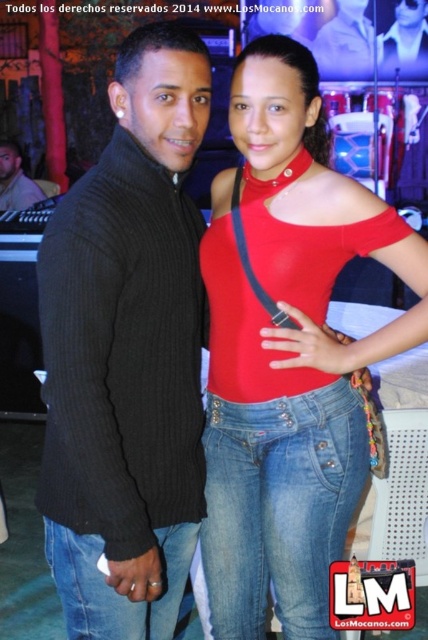
You are standing at the origin of the coordinate system in this image. You want to walk to the point that is closer to the camera. Which point should you head towards, point (x=133, y=157) or point (x=425, y=292)?

Point (x=133, y=157) is in front of point (x=425, y=292), so you should head towards point (x=133, y=157) since it is closer to the camera.

Please provide the 2D coordinates of the black ribbed sweater at center in the image. The coordinates should be in the format of a point with two decimal places, such as 0.552, 0.299.

The 2D coordinates of the black ribbed sweater at center are at point (x=127, y=353).

You are a photographer at a social event. You need to capture a photo where the matte red top at center and the matte black sweater at center are both visible. Which object should you position closer to the camera to ensure both are in focus?

The matte red top at center is positioned on the right side of the matte black sweater at center. To ensure both are in focus, position the camera so that both objects are at a similar distance from the lens, perhaps centering them or using a wide aperture to maximize depth of field.